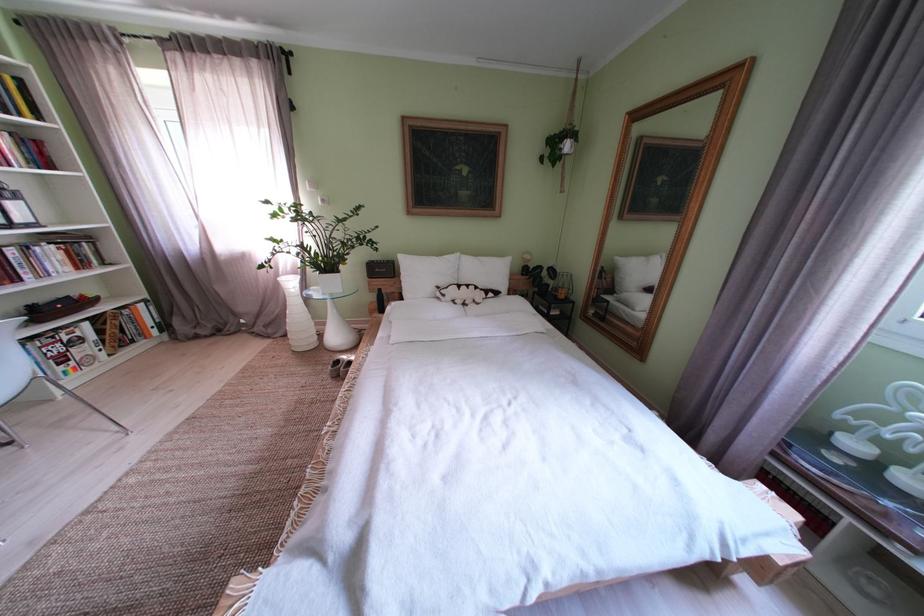
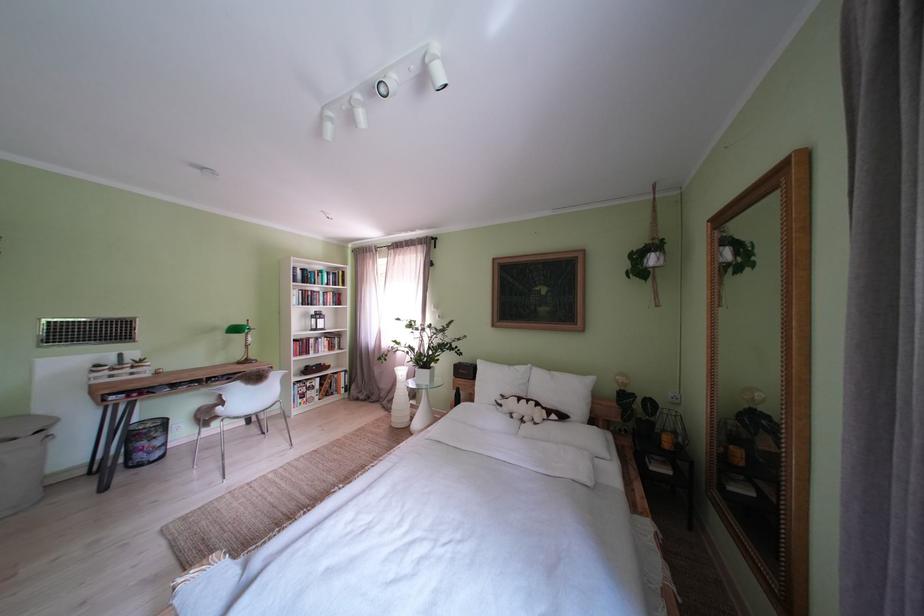
Find the pixel in the second image that matches (x=282, y=336) in the first image.

(400, 411)